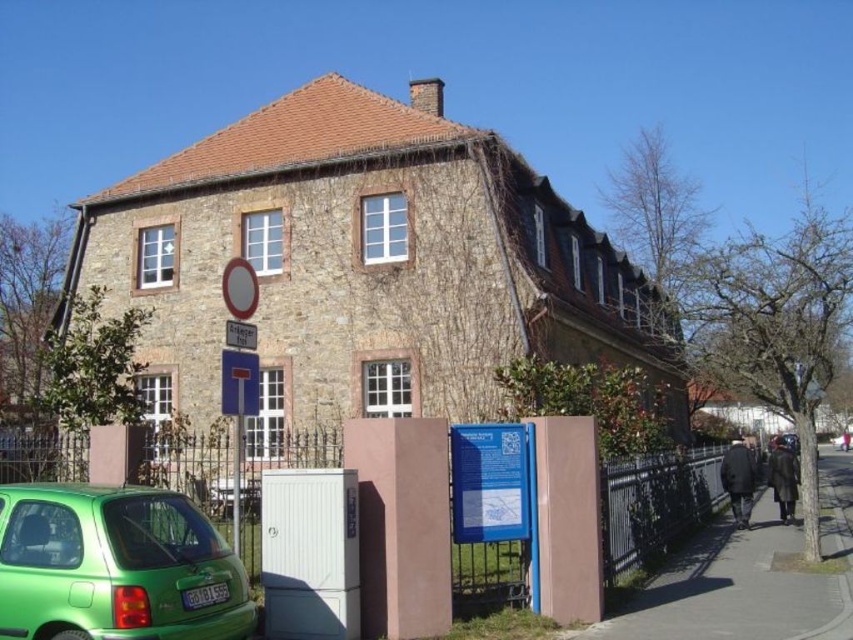
Question: Does green matte hatchback at lower left have a smaller size compared to metallic silver fence at lower center?

Choices:
 (A) no
 (B) yes

Answer: (B)

Question: Does green matte hatchback at lower left lie in front of metallic silver fence at lower center?

Choices:
 (A) no
 (B) yes

Answer: (B)

Question: Among these points, which one is nearest to the camera?

Choices:
 (A) pos(74,552)
 (B) pos(659,490)

Answer: (A)

Question: Which of the following is the closest to the observer?

Choices:
 (A) (140, 515)
 (B) (289, 461)

Answer: (A)

Question: Does green matte hatchback at lower left have a lesser width compared to metallic silver fence at lower center?

Choices:
 (A) yes
 (B) no

Answer: (A)

Question: Which object appears closest to the camera in this image?

Choices:
 (A) green matte hatchback at lower left
 (B) metallic silver fence at lower center

Answer: (A)